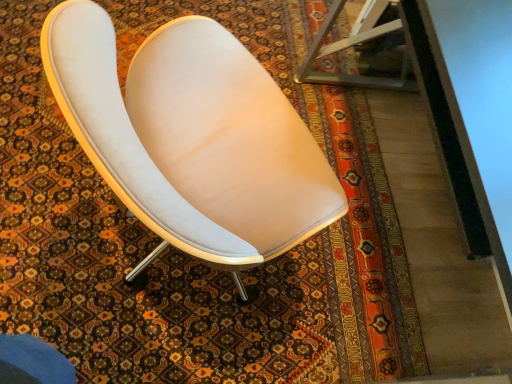
The width and height of the screenshot is (512, 384). Describe the element at coordinates (168, 95) in the screenshot. I see `satin white chair at center` at that location.

Locate an element on the screen. This screenshot has width=512, height=384. satin white chair at center is located at coordinates (168, 95).

The width and height of the screenshot is (512, 384). Find the location of `satin white chair at center`. satin white chair at center is located at coordinates (x=168, y=95).